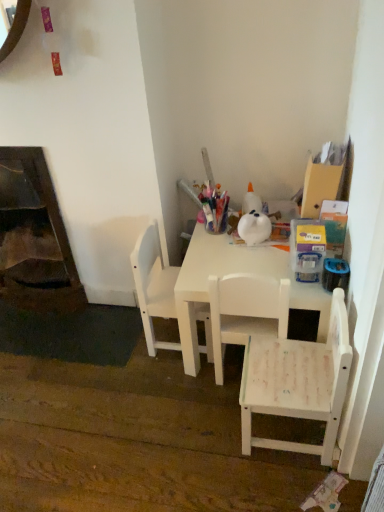
At what (x,y) coordinates should I click in order to perform the action: click on free space in front of white matte chair at center, positioned as the 1th chair in left-to-right order. Please return your answer as a coordinate pair (x, y). Looking at the image, I should click on (166, 385).